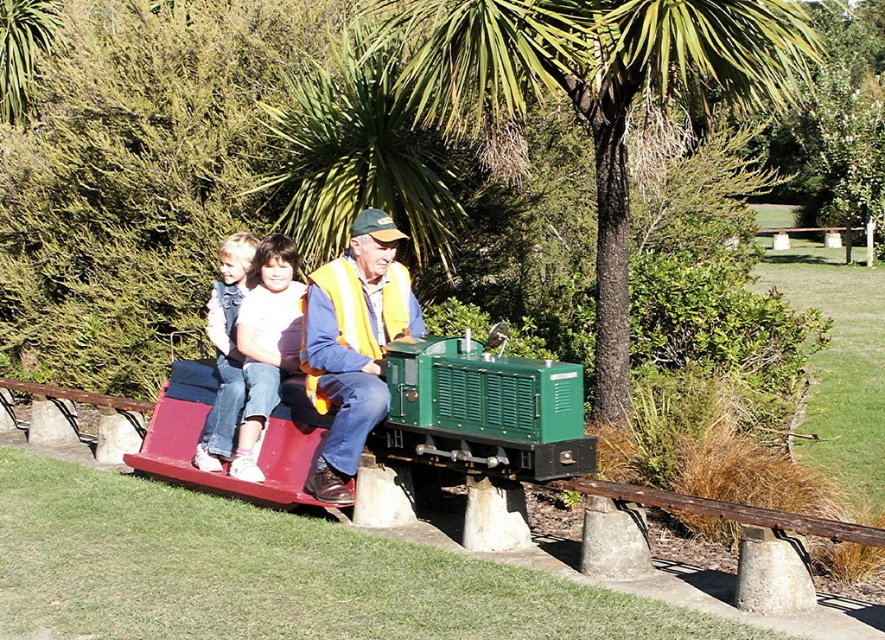
Which of these two, white cotton shirt at center or denim jeans at left, stands taller?

denim jeans at left is taller.

At what (x,y) coordinates should I click in order to perform the action: click on white cotton shirt at center. Please return your answer as a coordinate pair (x, y). Looking at the image, I should click on tap(266, 344).

Where is `white cotton shirt at center`? white cotton shirt at center is located at coordinates (266, 344).

Does green leafy palm tree at center appear on the right side of white cotton shirt at center?

Correct, you'll find green leafy palm tree at center to the right of white cotton shirt at center.

Who is positioned more to the left, green leafy palm tree at center or white cotton shirt at center?

white cotton shirt at center is more to the left.

Looking at this image, measure the distance between green leafy palm tree at center and camera.

A distance of 20.54 feet exists between green leafy palm tree at center and camera.

Identify the location of green leafy palm tree at center. (595, 93).

Between point (349, 353) and point (251, 428), which one is positioned in front?

Positioned in front is point (349, 353).

Does point (327, 298) lie behind point (241, 321)?

No, it is in front of (241, 321).

You are a GUI agent. You are given a task and a screenshot of the screen. Output one action in this format:
    pyautogui.click(x=<x>, y=<y>)
    Task: Click on the yellow reflective vest at center
    This screenshot has width=885, height=640.
    Given the screenshot: What is the action you would take?
    pyautogui.click(x=354, y=344)